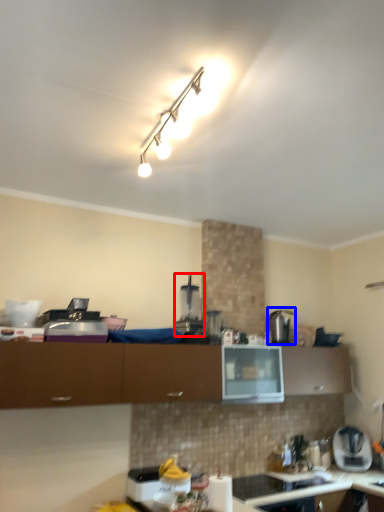
Question: Among these objects, which one is farthest to the camera, coffee machine (highlighted by a red box) or appliance (highlighted by a blue box)?

Choices:
 (A) coffee machine
 (B) appliance

Answer: (B)